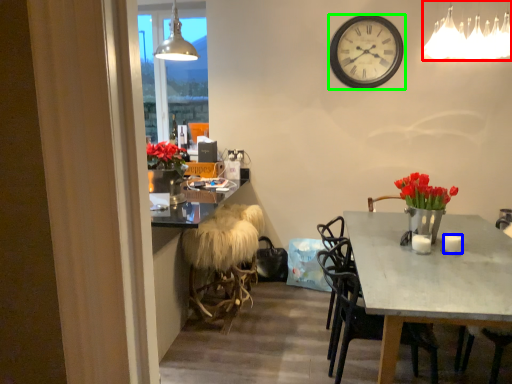
Question: Which is nearer to the lamp (highlighted by a red box)? coffee cup (highlighted by a blue box) or wall clock (highlighted by a green box).

Choices:
 (A) coffee cup
 (B) wall clock

Answer: (B)